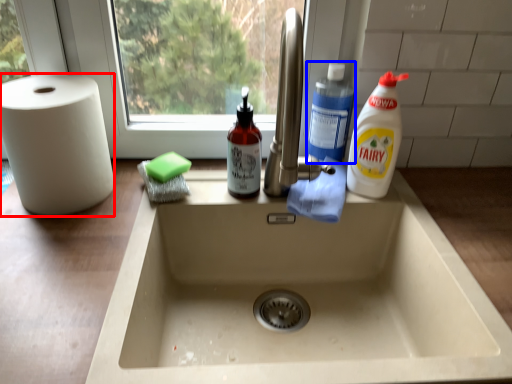
Question: Which object appears closest to the camera in this image, paper towel (highlighted by a red box) or cleaning product (highlighted by a blue box)?

Choices:
 (A) paper towel
 (B) cleaning product

Answer: (A)